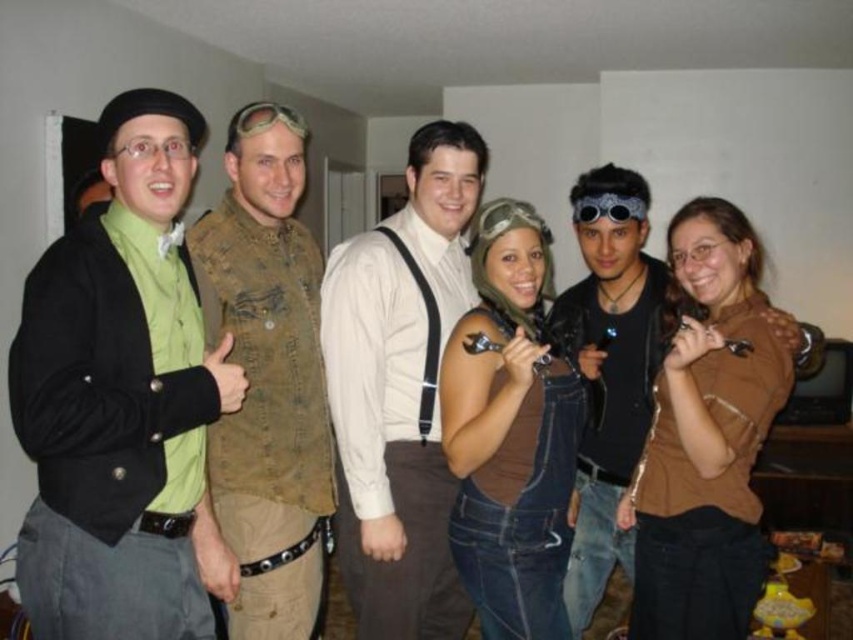
Does white matte shirt at center have a smaller size compared to metallic aviator goggles at upper center?

No, white matte shirt at center is not smaller than metallic aviator goggles at upper center.

Can you confirm if white matte shirt at center is thinner than metallic aviator goggles at upper center?

No.

Is point (405, 323) positioned before point (257, 116)?

That is False.

Locate an element on the screen. The width and height of the screenshot is (853, 640). white matte shirt at center is located at coordinates (399, 390).

Image resolution: width=853 pixels, height=640 pixels. I want to click on leather vest at center, so click(268, 387).

What do you see at coordinates (268, 387) in the screenshot? The height and width of the screenshot is (640, 853). I see `leather vest at center` at bounding box center [268, 387].

Find the location of a particular element. leather vest at center is located at coordinates (268, 387).

Who is lower down, brown matte shirt at center or metallic aviator goggles at upper center?

brown matte shirt at center

Who is more distant from viewer, [766,381] or [265,106]?

Positioned behind is point [265,106].

Where is `brown matte shirt at center`? brown matte shirt at center is located at coordinates (706, 440).